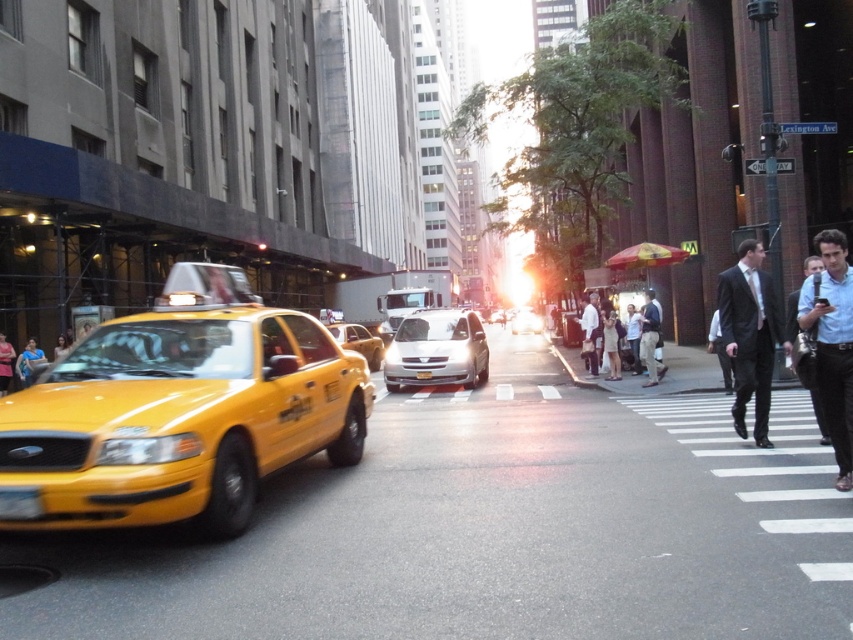
Does silver metallic van at center lie in front of shiny silver sedan at center?

Yes, silver metallic van at center is closer to the viewer.

Does silver metallic van at center appear over shiny silver sedan at center?

Actually, silver metallic van at center is below shiny silver sedan at center.

Identify the location of silver metallic van at center. Image resolution: width=853 pixels, height=640 pixels. (436, 349).

Between white shirt at center and dark suit at center, which one appears on the right side from the viewer's perspective?

dark suit at center

Locate an element on the screen. Image resolution: width=853 pixels, height=640 pixels. white shirt at center is located at coordinates (631, 340).

From the picture: Is khaki cotton pants at center to the left of dark suit at center from the viewer's perspective?

Correct, you'll find khaki cotton pants at center to the left of dark suit at center.

Locate an element on the screen. The width and height of the screenshot is (853, 640). khaki cotton pants at center is located at coordinates (650, 339).